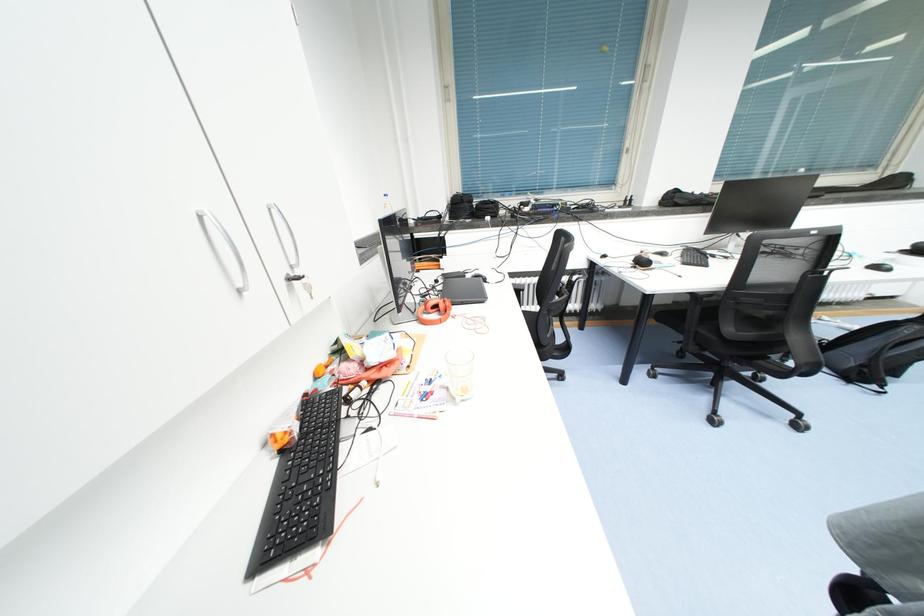
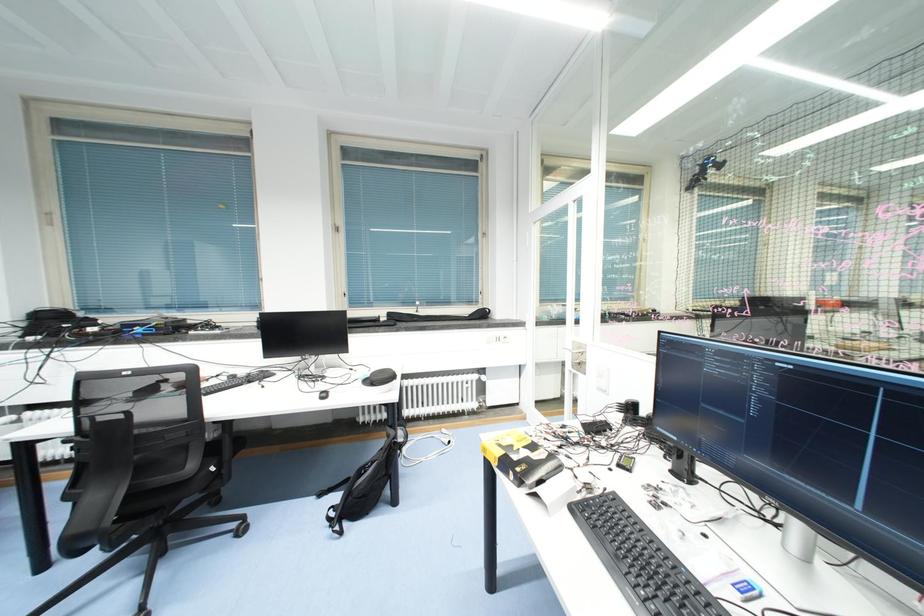
Question: Which direction would the cameraman need to move to produce the second image? Reply with the corresponding letter.

Choices:
 (A) Left
 (B) Right
 (C) Forward
 (D) Backward

Answer: (B)